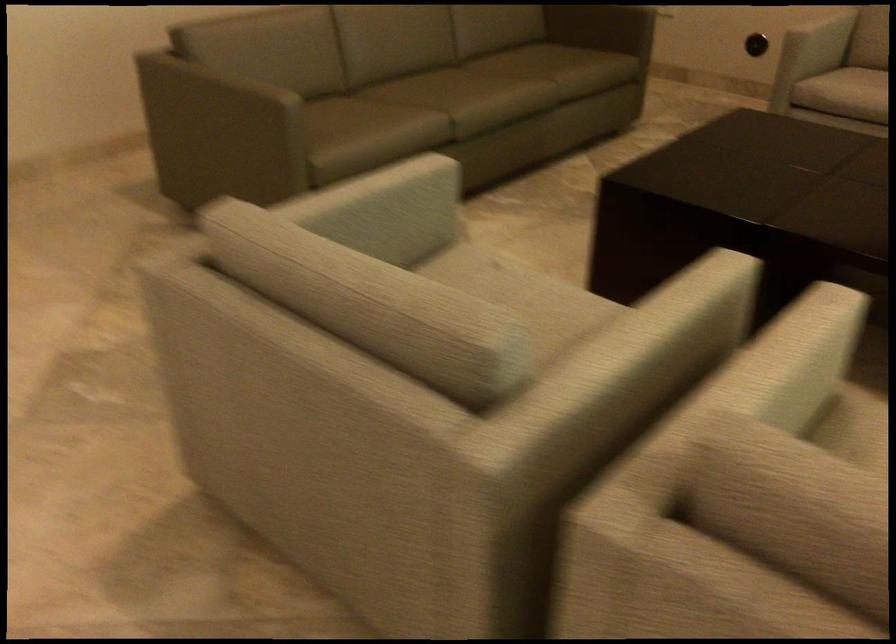
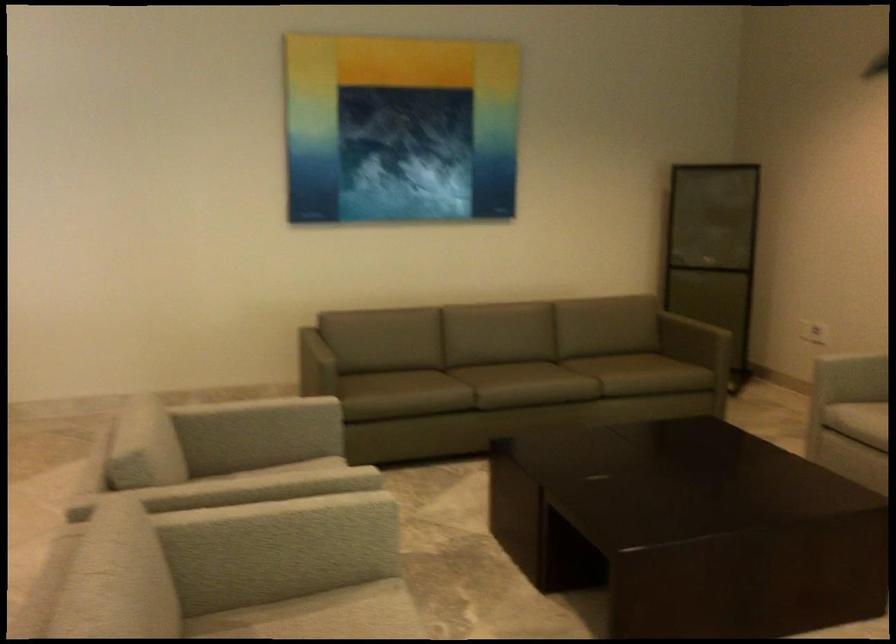
Locate, in the second image, the point that corresponds to the point at 803,362 in the first image.

(289, 529)